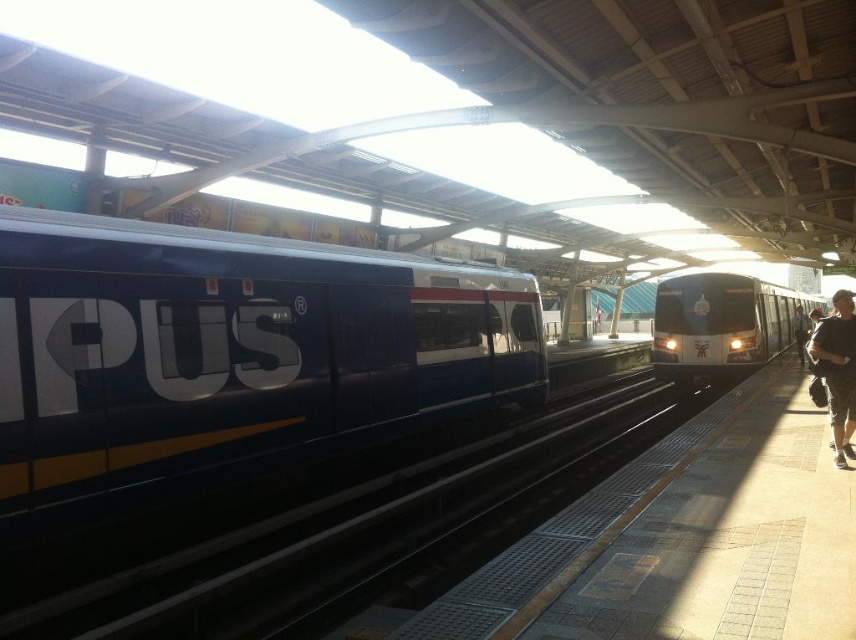
Between blue glossy train at left and black metal train track at center, which one has less height?

With less height is black metal train track at center.

Can you confirm if blue glossy train at left is positioned above black metal train track at center?

Correct, blue glossy train at left is located above black metal train track at center.

This screenshot has width=856, height=640. I want to click on blue glossy train at left, so click(x=229, y=355).

Where is `blue glossy train at left`? blue glossy train at left is located at coordinates (229, 355).

Can you confirm if black metal train track at center is thinner than black fabric bag at right?

No.

Which is behind, point (533, 504) or point (827, 332)?

Point (533, 504)

In order to click on black metal train track at center in this screenshot , I will do `click(366, 532)`.

Which is more to the right, shiny silver train at center or black leather jacket at right?

Positioned to the right is black leather jacket at right.

Which of these two, shiny silver train at center or black leather jacket at right, stands shorter?

black leather jacket at right

Is point (715, 333) positioned before point (798, 356)?

That is True.

Identify the location of shiny silver train at center. (722, 324).